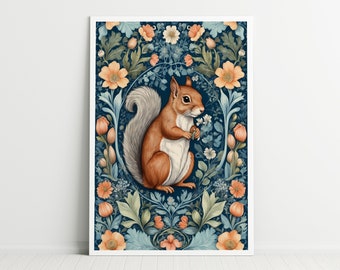
Locate an element on the screen. The image size is (340, 270). white tile is located at coordinates pyautogui.click(x=249, y=263).